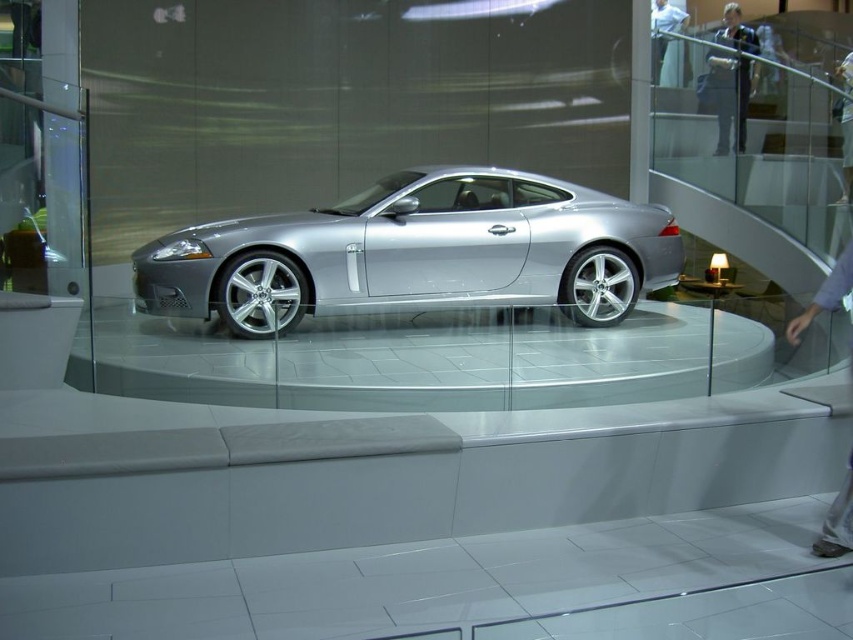
Between silver metallic car at center and dark blue suit at upper right, which one is positioned higher?

dark blue suit at upper right is higher up.

Image resolution: width=853 pixels, height=640 pixels. What do you see at coordinates (416, 252) in the screenshot?
I see `silver metallic car at center` at bounding box center [416, 252].

Identify the location of silver metallic car at center. (416, 252).

Who is taller, silver metallic car at center or light blue shirt at upper center?

Standing taller between the two is silver metallic car at center.

Can you confirm if silver metallic car at center is taller than light blue shirt at upper center?

Correct, silver metallic car at center is much taller as light blue shirt at upper center.

Describe the element at coordinates (416, 252) in the screenshot. I see `silver metallic car at center` at that location.

I want to click on silver metallic car at center, so click(416, 252).

Can you confirm if dark blue suit at upper right is positioned below light blue shirt at upper center?

Correct, dark blue suit at upper right is located below light blue shirt at upper center.

Measure the distance between dark blue suit at upper right and light blue shirt at upper center.

They are 2.78 meters apart.

Find the location of a particular element. dark blue suit at upper right is located at coordinates (729, 97).

Image resolution: width=853 pixels, height=640 pixels. Identify the location of dark blue suit at upper right. (729, 97).